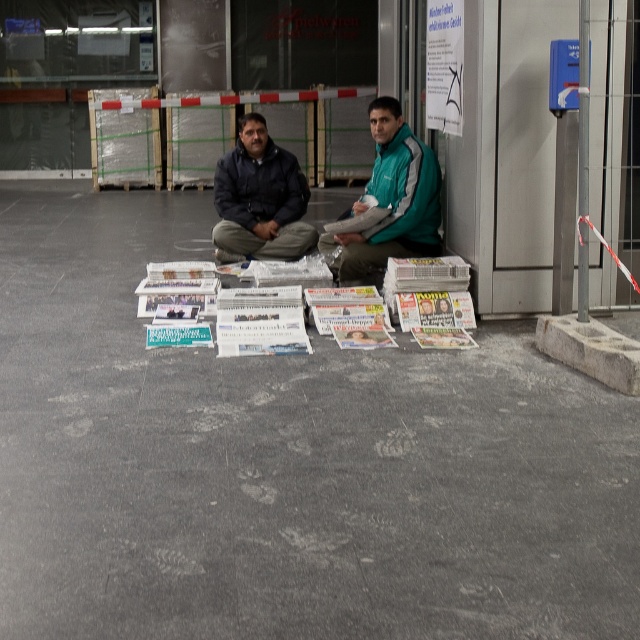
You are trying to place a large rectangular box that is as wide as the gray concrete floor at center. Will the dark blue jacket at center fit on the floor next to the box without overlapping?

The gray concrete floor at center is wider than the dark blue jacket at center, so yes, the dark blue jacket at center can fit on the floor next to the box without overlapping since the floor has enough width to accommodate both.

You are a photographer trying to capture a clear shot of the white glossy magazines at center. However, the teal fabric jacket at center is blocking your view. Can you move the jacket to get a clear shot of the magazines?

The white glossy magazines at center is located below the teal fabric jacket at center, so moving the teal fabric jacket at center would allow you to see the white glossy magazines at center clearly.